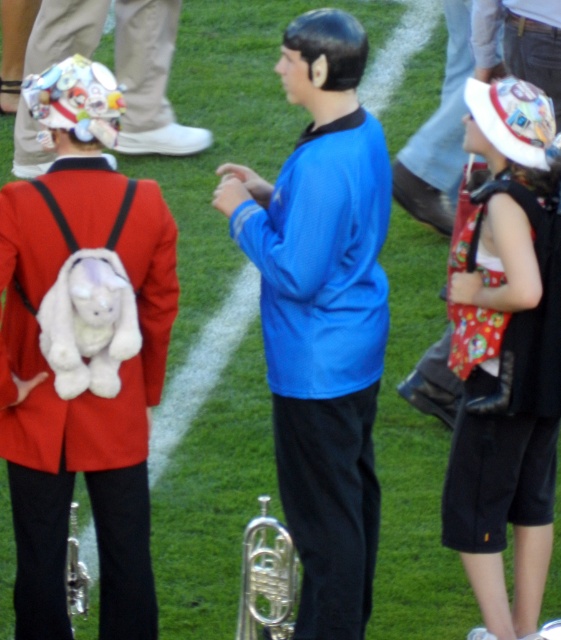
Question: Is white plush backpack at back smaller than red fabric backpack at right?

Choices:
 (A) no
 (B) yes

Answer: (A)

Question: Among these objects, which one is farthest from the camera?

Choices:
 (A) white plush backpack at back
 (B) silver metallic trumpet at center

Answer: (B)

Question: Can you confirm if matte red jacket at left is thinner than silver polished trumpet at center?

Choices:
 (A) yes
 (B) no

Answer: (B)

Question: Which point is closer to the camera?

Choices:
 (A) silver metallic trumpet at center
 (B) silver polished trumpet at center
 (C) blue fabric shirt at center

Answer: (C)

Question: Can you confirm if silver polished trumpet at center is positioned above silver metallic trumpet at center?

Choices:
 (A) no
 (B) yes

Answer: (B)

Question: Estimate the real-world distances between objects in this image. Which object is closer to the red fabric backpack at right?

Choices:
 (A) white plush backpack at back
 (B) matte red jacket at left
 (C) silver polished trumpet at center
 (D) silver metallic trumpet at center

Answer: (C)